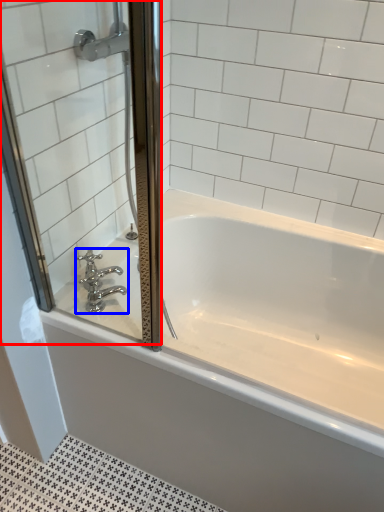
Question: Which point is further to the camera, screen door (highlighted by a red box) or tap (highlighted by a blue box)?

Choices:
 (A) screen door
 (B) tap

Answer: (B)